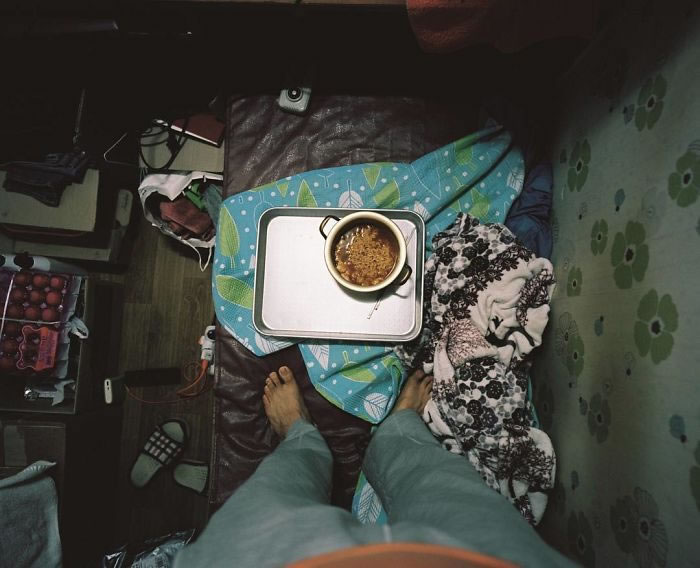
Identify the location of bowl. The image size is (700, 568). (391, 223).